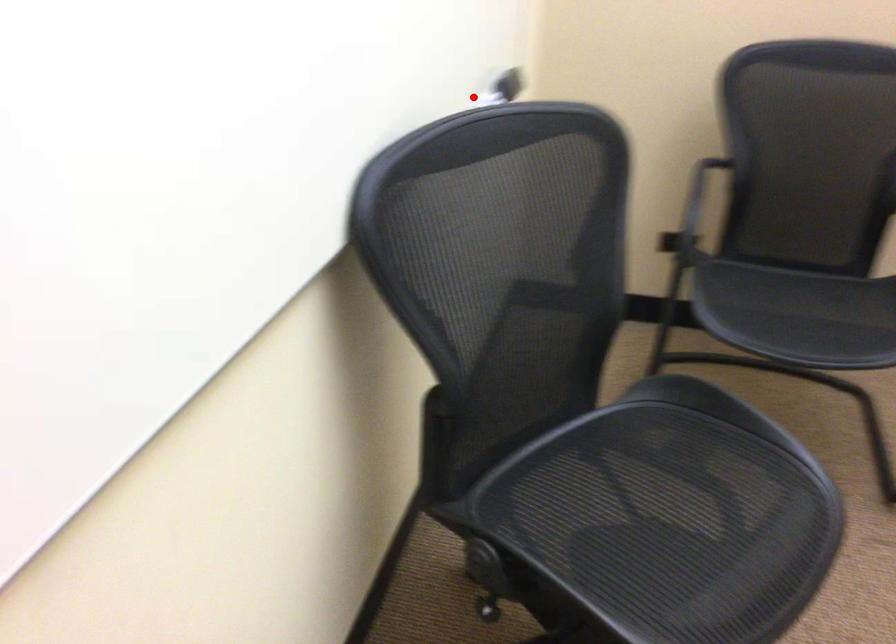
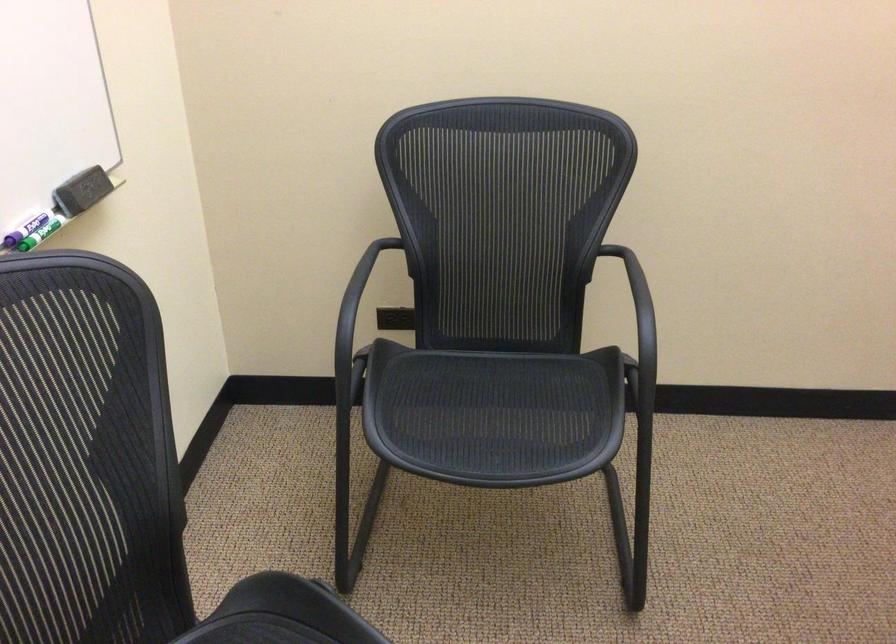
Question: A red point is marked in image1. In image2, is the corresponding 3D point closer to the camera or farther? Reply with the corresponding letter.

Choices:
 (A) The corresponding 3D point is closer.
 (B) The corresponding 3D point is farther.

Answer: (A)